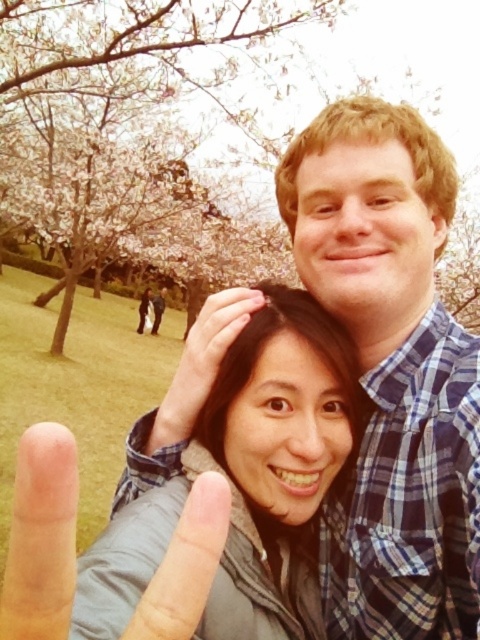
Which is below, blue plaid shirt at center or matte skin at center?

blue plaid shirt at center is lower down.

Can you confirm if blue plaid shirt at center is wider than matte skin at center?

Indeed, blue plaid shirt at center has a greater width compared to matte skin at center.

Is point (432, 403) less distant than point (177, 429)?

Yes, it is.

Locate an element on the screen. blue plaid shirt at center is located at coordinates (392, 369).

Based on the photo, does cherry blossom tree at upper left have a greater height compared to matte skin at center?

Correct, cherry blossom tree at upper left is much taller as matte skin at center.

Is point (248, 115) farther from camera compared to point (200, 310)?

No, it is in front of (200, 310).

Between point (227, 44) and point (238, 324), which one is positioned in front?

Point (238, 324) is more forward.

This screenshot has width=480, height=640. Identify the location of cherry blossom tree at upper left. (131, 49).

Which of these two, blue plaid shirt at center or cherry blossom tree at upper left, stands taller?

With more height is cherry blossom tree at upper left.

Does blue plaid shirt at center appear under cherry blossom tree at upper left?

Yes.

Consider the image. Who is more distant from viewer, (468, 515) or (120, 100)?

The point (120, 100) is more distant.

This screenshot has height=640, width=480. What are the coordinates of `blue plaid shirt at center` in the screenshot? It's located at (392, 369).